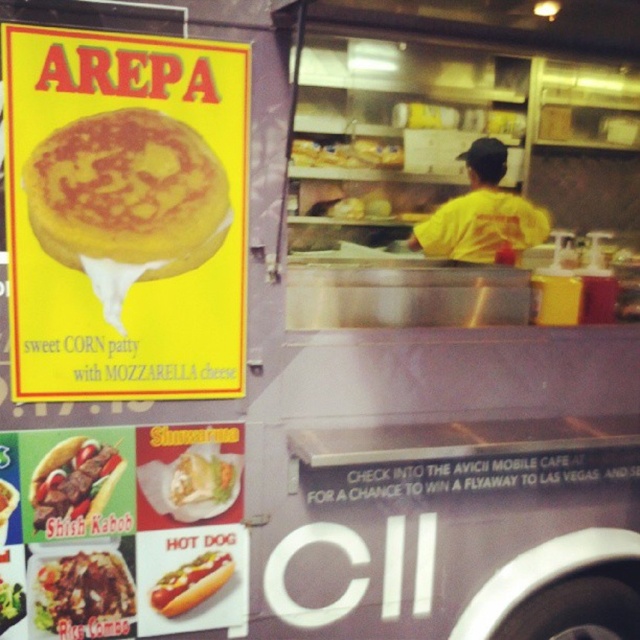
You are a customer at the food truck and want to order both the yellow matte arepa at upper left and the shiny white hot dog at lower center. Which item is positioned higher on the menu board?

The yellow matte arepa at upper left is located above the shiny white hot dog at lower center, so it is positioned higher on the menu board.

You are a customer looking to order a meal. You see the brown rice at center and the shiny white hot dog at lower center on the menu. Which item is taller in the image?

The brown rice at center is taller than the shiny white hot dog at lower center in the image.

You are a customer at the food truck and want to choose between the brown rice at center and the shiny yellow hot dog at center. Which option is wider?

The brown rice at center is wider than the shiny yellow hot dog at center.